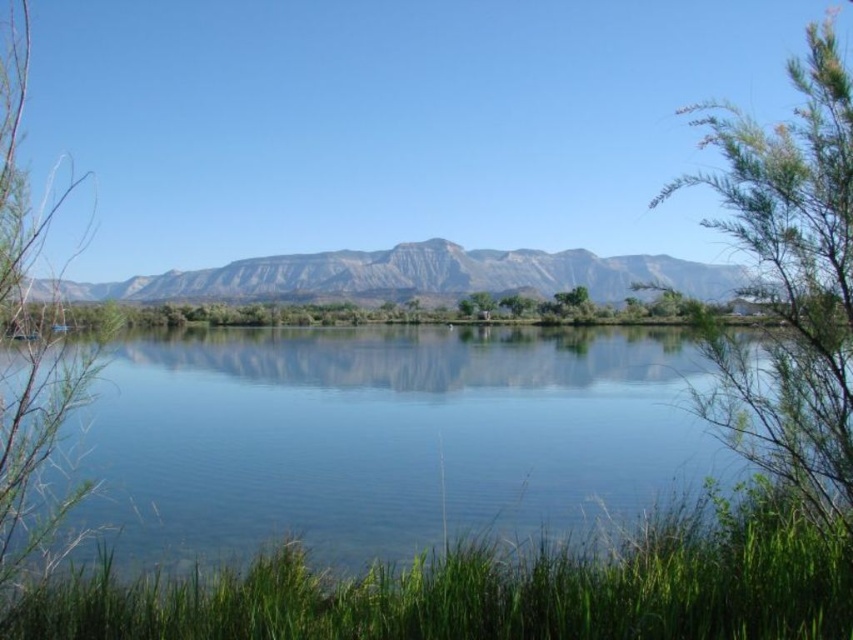
You are standing at the point closer to the camera in the image. Which point are you at, point (566, 461) or point (567, 308)?

You are at point (566, 461) because it is closer to the camera than point (567, 308).

You are an environmental scientist assessing the landscape. You need to determine which object occupies more space in the image between the clear water at center and the green leafy tree at center. Which one is larger?

The clear water at center has a larger size compared to the green leafy tree at center, so the clear water at center occupies more space in the image.